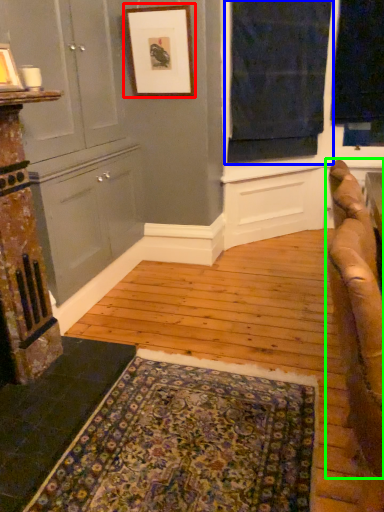
Question: Considering the real-world distances, which object is farthest from picture frame (highlighted by a red box)? window (highlighted by a blue box) or studio couch (highlighted by a green box)?

Choices:
 (A) window
 (B) studio couch

Answer: (B)